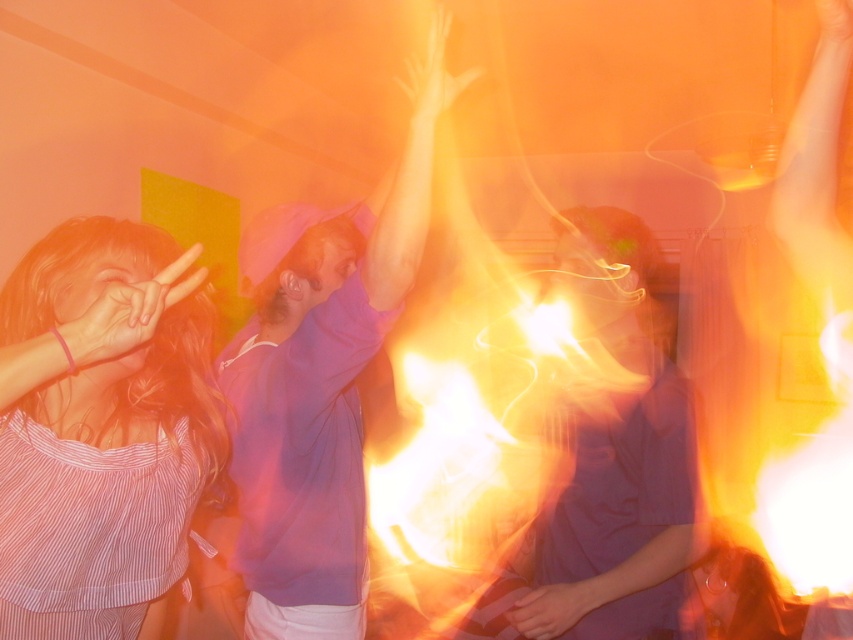
Is striped fabric shirt at left thinner than purple matte shirt at center?

In fact, striped fabric shirt at left might be wider than purple matte shirt at center.

Between striped fabric shirt at left and purple matte shirt at center, which one is positioned lower?

purple matte shirt at center

Between point (155, 356) and point (589, 248), which one is positioned behind?

Point (589, 248)

This screenshot has width=853, height=640. I want to click on striped fabric shirt at left, so click(103, 404).

What do you see at coordinates (103, 404) in the screenshot?
I see `striped fabric shirt at left` at bounding box center [103, 404].

Which is below, striped fabric shirt at left or purple matte hoodie at center?

Positioned lower is striped fabric shirt at left.

Locate an element on the screen. striped fabric shirt at left is located at coordinates (103, 404).

Looking at this image, who is positioned more to the left, purple matte hoodie at center or purple matte shirt at center?

purple matte hoodie at center is more to the left.

Is purple matte hoodie at center to the right of purple matte shirt at center from the viewer's perspective?

Incorrect, purple matte hoodie at center is not on the right side of purple matte shirt at center.

This screenshot has height=640, width=853. Describe the element at coordinates (323, 387) in the screenshot. I see `purple matte hoodie at center` at that location.

The height and width of the screenshot is (640, 853). Find the location of `purple matte hoodie at center`. purple matte hoodie at center is located at coordinates (323, 387).